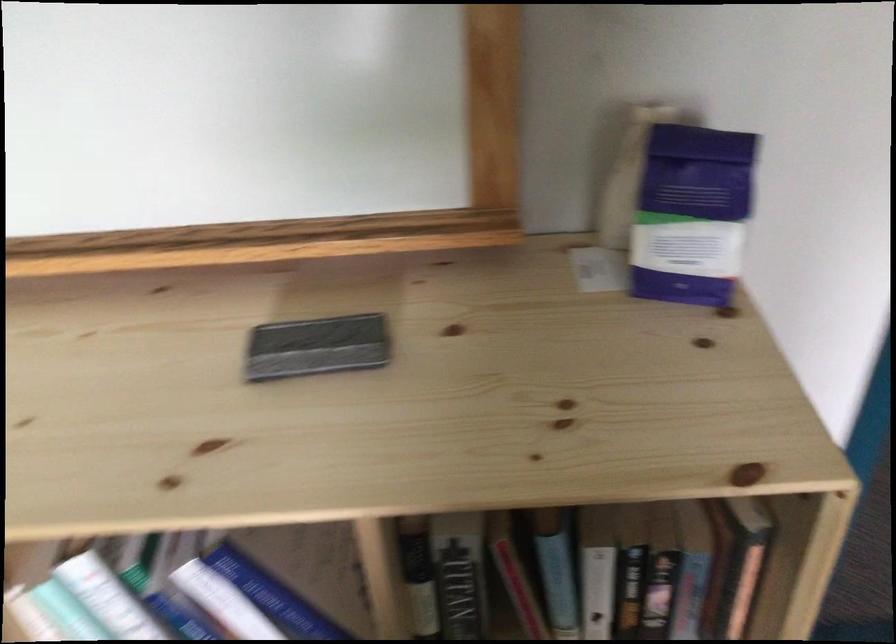
Which object does [316,346] point to?

It corresponds to the whiteboard eraser in the image.